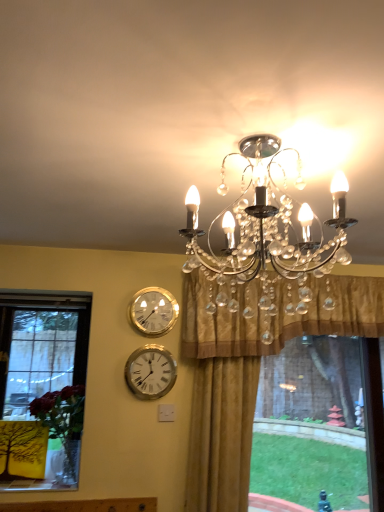
At what (x,y) coordinates should I click in order to perform the action: click on gold metallic wall clock at upper center, which is the 2th wall clock in bottom-to-top order. Please return your answer as a coordinate pair (x, y). The width and height of the screenshot is (384, 512). Looking at the image, I should click on (154, 311).

At what (x,y) coordinates should I click in order to perform the action: click on gold satin curtain at upper center. Please return your answer as a coordinate pair (x, y). Looking at the image, I should click on (276, 314).

Which object is positioned more to the right, gold satin curtain at upper center or white metallic clock at center, marked as the 1th wall clock in a bottom-to-top arrangement?

Positioned to the right is gold satin curtain at upper center.

Is gold satin curtain at upper center bigger or smaller than white metallic clock at center, marked as the second wall clock in a top-to-bottom arrangement?

Clearly, gold satin curtain at upper center is larger in size than white metallic clock at center, marked as the second wall clock in a top-to-bottom arrangement.

From a real-world perspective, is gold satin curtain at upper center positioned above or below white metallic clock at center, marked as the second wall clock in a top-to-bottom arrangement?

Clearly, from a real-world perspective, gold satin curtain at upper center is above white metallic clock at center, marked as the second wall clock in a top-to-bottom arrangement.

Considering the sizes of objects gold satin curtain at upper center and gold metallic wall clock at upper center, which is the 2th wall clock in bottom-to-top order, in the image provided, who is thinner, gold satin curtain at upper center or gold metallic wall clock at upper center, which is the 2th wall clock in bottom-to-top order,?

With smaller width is gold metallic wall clock at upper center, which is the 2th wall clock in bottom-to-top order.

Considering the positions of objects gold satin curtain at upper center and gold metallic wall clock at upper center, which is the 2th wall clock in bottom-to-top order, in the image provided, who is more to the right, gold satin curtain at upper center or gold metallic wall clock at upper center, which is the 2th wall clock in bottom-to-top order,?

gold satin curtain at upper center.

From a real-world perspective, is gold satin curtain at upper center positioned under gold metallic wall clock at upper center, which is the first wall clock in top-to-bottom order, based on gravity?

No, from a real-world perspective, gold satin curtain at upper center is not below gold metallic wall clock at upper center, which is the first wall clock in top-to-bottom order.

How different are the orientations of gold satin curtain at upper center and gold metallic wall clock at upper center, which is the first wall clock in top-to-bottom order, in degrees?

The angular difference between gold satin curtain at upper center and gold metallic wall clock at upper center, which is the first wall clock in top-to-bottom order, is 0.0801 degrees.

The width and height of the screenshot is (384, 512). In order to click on wall clock to the right of gold metallic wall clock at upper center, which is the first wall clock in top-to-bottom order in this screenshot , I will do `click(150, 372)`.

Which is more to the left, white metallic clock at center, marked as the 1th wall clock in a bottom-to-top arrangement, or gold metallic wall clock at upper center, which is the first wall clock in top-to-bottom order?

From the viewer's perspective, gold metallic wall clock at upper center, which is the first wall clock in top-to-bottom order, appears more on the left side.

How far apart are white metallic clock at center, marked as the second wall clock in a top-to-bottom arrangement, and gold metallic wall clock at upper center, which is the 2th wall clock in bottom-to-top order?

The distance of white metallic clock at center, marked as the second wall clock in a top-to-bottom arrangement, from gold metallic wall clock at upper center, which is the 2th wall clock in bottom-to-top order, is 8.18 inches.

Does white metallic clock at center, marked as the second wall clock in a top-to-bottom arrangement, have a larger size compared to gold metallic wall clock at upper center, which is the 2th wall clock in bottom-to-top order?

Indeed, white metallic clock at center, marked as the second wall clock in a top-to-bottom arrangement, has a larger size compared to gold metallic wall clock at upper center, which is the 2th wall clock in bottom-to-top order.

From a real-world perspective, between clear crystal chandelier at upper center and white metallic clock at center, marked as the 1th wall clock in a bottom-to-top arrangement, who is vertically higher?

In real-world perspective, clear crystal chandelier at upper center is above.

Who is taller, clear crystal chandelier at upper center or white metallic clock at center, marked as the second wall clock in a top-to-bottom arrangement?

clear crystal chandelier at upper center.

Which object is positioned more to the left, clear crystal chandelier at upper center or white metallic clock at center, marked as the second wall clock in a top-to-bottom arrangement?

From the viewer's perspective, white metallic clock at center, marked as the second wall clock in a top-to-bottom arrangement, appears more on the left side.

From the image's perspective, which one is positioned higher, clear crystal chandelier at upper center or white metallic clock at center, marked as the second wall clock in a top-to-bottom arrangement?

clear crystal chandelier at upper center, from the image's perspective.

Considering the positions of objects gold metallic wall clock at upper center, which is the 2th wall clock in bottom-to-top order, and gold satin curtain at upper center in the image provided, who is behind, gold metallic wall clock at upper center, which is the 2th wall clock in bottom-to-top order, or gold satin curtain at upper center?

gold metallic wall clock at upper center, which is the 2th wall clock in bottom-to-top order, is further from the camera.

Could you tell me if gold metallic wall clock at upper center, which is the 2th wall clock in bottom-to-top order, is facing gold satin curtain at upper center?

No, gold metallic wall clock at upper center, which is the 2th wall clock in bottom-to-top order, does not turn towards gold satin curtain at upper center.

From a real-world perspective, relative to gold satin curtain at upper center, is gold metallic wall clock at upper center, which is the first wall clock in top-to-bottom order, vertically above or below?

gold metallic wall clock at upper center, which is the first wall clock in top-to-bottom order, is situated lower than gold satin curtain at upper center in the real world.

From the gold satin curtain at upper center, count the 2nd wall clock to the left and point to it. Please provide its 2D coordinates.

[(154, 311)]

Is clear crystal chandelier at upper center to the left or to the right of gold metallic wall clock at upper center, which is the first wall clock in top-to-bottom order, in the image?

From the image, it's evident that clear crystal chandelier at upper center is to the right of gold metallic wall clock at upper center, which is the first wall clock in top-to-bottom order.

Is clear crystal chandelier at upper center smaller than gold metallic wall clock at upper center, which is the 2th wall clock in bottom-to-top order?

No, clear crystal chandelier at upper center is not smaller than gold metallic wall clock at upper center, which is the 2th wall clock in bottom-to-top order.

Is point (274, 186) positioned behind point (161, 294)?

No, it is in front of (161, 294).

Which object is closer to the camera taking this photo, clear crystal chandelier at upper center or gold metallic wall clock at upper center, which is the first wall clock in top-to-bottom order?

clear crystal chandelier at upper center is closer to the camera.

Which object is closer to the camera taking this photo, white metallic clock at center, marked as the second wall clock in a top-to-bottom arrangement, or clear crystal chandelier at upper center?

Positioned in front is clear crystal chandelier at upper center.

Is white metallic clock at center, marked as the 1th wall clock in a bottom-to-top arrangement, outside of clear crystal chandelier at upper center?

white metallic clock at center, marked as the 1th wall clock in a bottom-to-top arrangement, is positioned outside clear crystal chandelier at upper center.

From the image's perspective, between white metallic clock at center, marked as the 1th wall clock in a bottom-to-top arrangement, and clear crystal chandelier at upper center, who is located below?

From the image's view, white metallic clock at center, marked as the 1th wall clock in a bottom-to-top arrangement, is below.

Locate an element on the screen. lamp that appears above the white metallic clock at center, marked as the 1th wall clock in a bottom-to-top arrangement (from a real-world perspective) is located at coordinates (270, 225).

Identify the location of curtain that is above the white metallic clock at center, marked as the 1th wall clock in a bottom-to-top arrangement (from a real-world perspective). The width and height of the screenshot is (384, 512). (276, 314).

Locate an element on the screen. curtain located below the gold metallic wall clock at upper center, which is the first wall clock in top-to-bottom order (from the image's perspective) is located at coordinates (276, 314).

Estimate the real-world distances between objects in this image. Which object is further from white metallic clock at center, marked as the second wall clock in a top-to-bottom arrangement, gold metallic wall clock at upper center, which is the first wall clock in top-to-bottom order, or gold satin curtain at upper center?

gold satin curtain at upper center.

Looking at this image, when comparing their distances from gold metallic wall clock at upper center, which is the 2th wall clock in bottom-to-top order, does gold satin curtain at upper center or white metallic clock at center, marked as the second wall clock in a top-to-bottom arrangement, seem further?

gold satin curtain at upper center is further to gold metallic wall clock at upper center, which is the 2th wall clock in bottom-to-top order.

Estimate the real-world distances between objects in this image. Which object is further from white metallic clock at center, marked as the 1th wall clock in a bottom-to-top arrangement, gold satin curtain at upper center or clear crystal chandelier at upper center?

clear crystal chandelier at upper center lies further to white metallic clock at center, marked as the 1th wall clock in a bottom-to-top arrangement, than the other object.

Which object lies further to the anchor point gold satin curtain at upper center, gold metallic wall clock at upper center, which is the first wall clock in top-to-bottom order, or white metallic clock at center, marked as the 1th wall clock in a bottom-to-top arrangement?

white metallic clock at center, marked as the 1th wall clock in a bottom-to-top arrangement, is further to gold satin curtain at upper center.

Looking at the image, which one is located further to gold metallic wall clock at upper center, which is the 2th wall clock in bottom-to-top order, white metallic clock at center, marked as the second wall clock in a top-to-bottom arrangement, or clear crystal chandelier at upper center?

clear crystal chandelier at upper center is further to gold metallic wall clock at upper center, which is the 2th wall clock in bottom-to-top order.

From the picture: Based on their spatial positions, is gold metallic wall clock at upper center, which is the first wall clock in top-to-bottom order, or clear crystal chandelier at upper center further from white metallic clock at center, marked as the 1th wall clock in a bottom-to-top arrangement?

clear crystal chandelier at upper center is positioned further to the anchor white metallic clock at center, marked as the 1th wall clock in a bottom-to-top arrangement.

From the image, which object appears to be nearer to clear crystal chandelier at upper center, gold metallic wall clock at upper center, which is the first wall clock in top-to-bottom order, or gold satin curtain at upper center?

Based on the image, gold satin curtain at upper center appears to be nearer to clear crystal chandelier at upper center.

Which object lies nearer to the anchor point clear crystal chandelier at upper center, gold metallic wall clock at upper center, which is the 2th wall clock in bottom-to-top order, or white metallic clock at center, marked as the 1th wall clock in a bottom-to-top arrangement?

The object closer to clear crystal chandelier at upper center is gold metallic wall clock at upper center, which is the 2th wall clock in bottom-to-top order.

What are the coordinates of `wall clock situated between gold metallic wall clock at upper center, which is the 2th wall clock in bottom-to-top order, and gold satin curtain at upper center from left to right` in the screenshot? It's located at (150, 372).

Image resolution: width=384 pixels, height=512 pixels. I want to click on curtain positioned between clear crystal chandelier at upper center and white metallic clock at center, marked as the second wall clock in a top-to-bottom arrangement, from near to far, so click(276, 314).

You are a GUI agent. You are given a task and a screenshot of the screen. Output one action in this format:
    pyautogui.click(x=<x>, y=<y>)
    Task: Click on the curtain between clear crystal chandelier at upper center and gold metallic wall clock at upper center, which is the first wall clock in top-to-bottom order, along the z-axis
    The image size is (384, 512).
    Given the screenshot: What is the action you would take?
    pyautogui.click(x=276, y=314)

Locate an element on the screen. wall clock between clear crystal chandelier at upper center and gold metallic wall clock at upper center, which is the 2th wall clock in bottom-to-top order, from front to back is located at coordinates (150, 372).